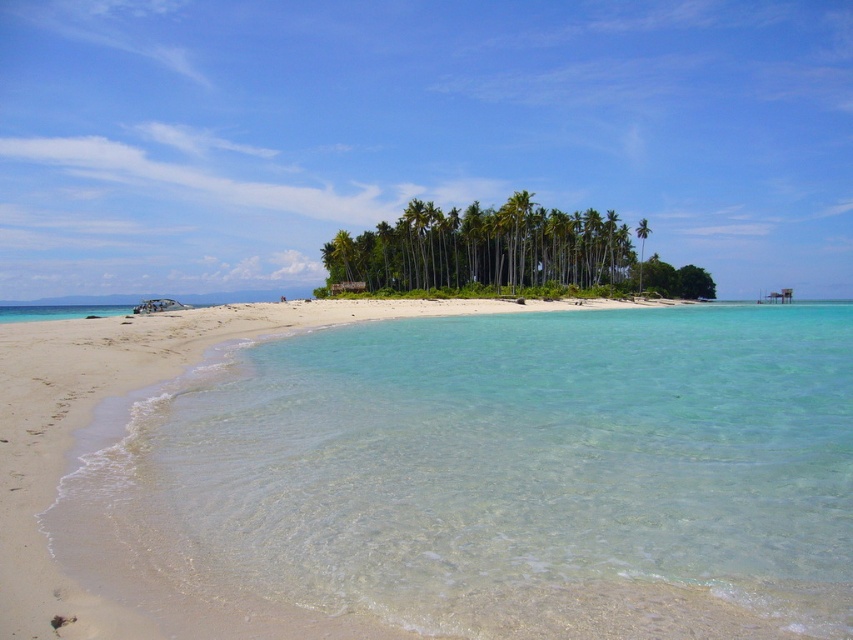
You are standing on the beach and want to take a photo of the green leafy palm trees at center. According to the coordinates provided, where should you position yourself to ensure the palm trees are centered in your camera frame?

The green leafy palm trees at center are located at coordinates point (483, 248), so you should position yourself directly facing that coordinate point to center them in your camera frame.

You are standing at the center of the beach and want to walk to the water. Which direction should you head to reach the light beige sand at lower left?

The light beige sand at lower left is located at point (122, 396), so you should head towards the lower left direction to reach it.